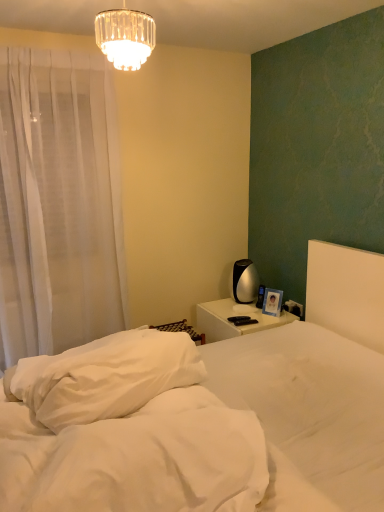
Locate an element on the screen. Image resolution: width=384 pixels, height=512 pixels. blank space situated above white glossy nightstand at center (from a real-world perspective) is located at coordinates click(247, 312).